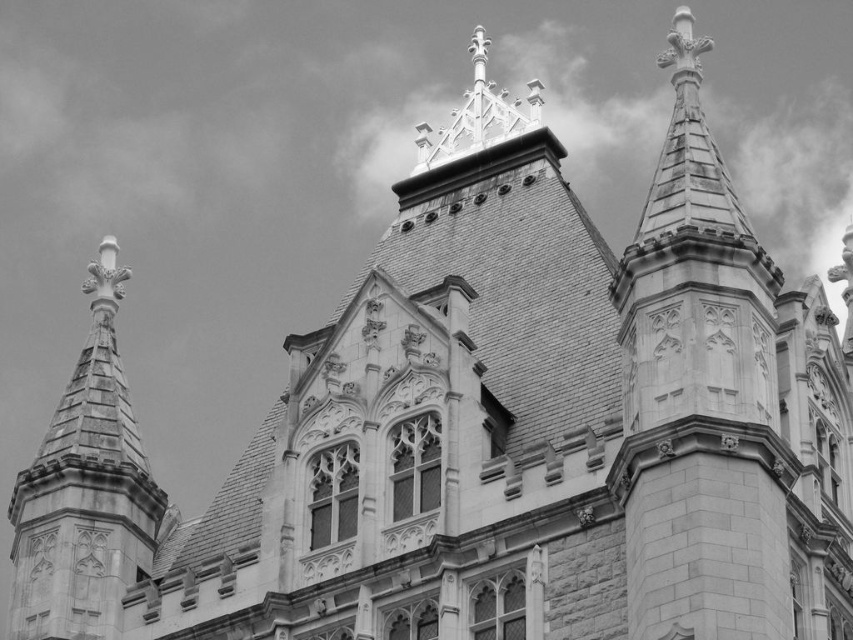
What do you see at coordinates (699, 396) in the screenshot? I see `white stone steeple at upper right` at bounding box center [699, 396].

Can you confirm if white stone steeple at upper right is taller than stone spire at left?

Incorrect, white stone steeple at upper right's height is not larger of stone spire at left's.

Does point (741, 212) lie in front of point (77, 540)?

Yes, point (741, 212) is closer to viewer.

The image size is (853, 640). Identify the location of white stone steeple at upper right. (699, 396).